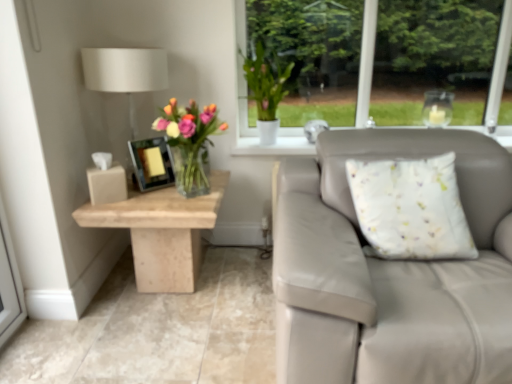
Where is `free spot in front of beige marble table at left`? Image resolution: width=512 pixels, height=384 pixels. free spot in front of beige marble table at left is located at coordinates (140, 344).